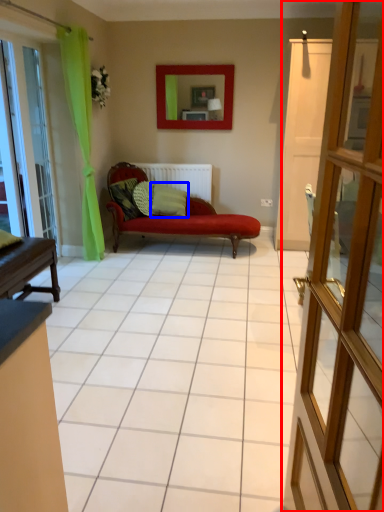
Question: Which of the following is the farthest to the observer, door (highlighted by a red box) or pillow (highlighted by a blue box)?

Choices:
 (A) door
 (B) pillow

Answer: (B)